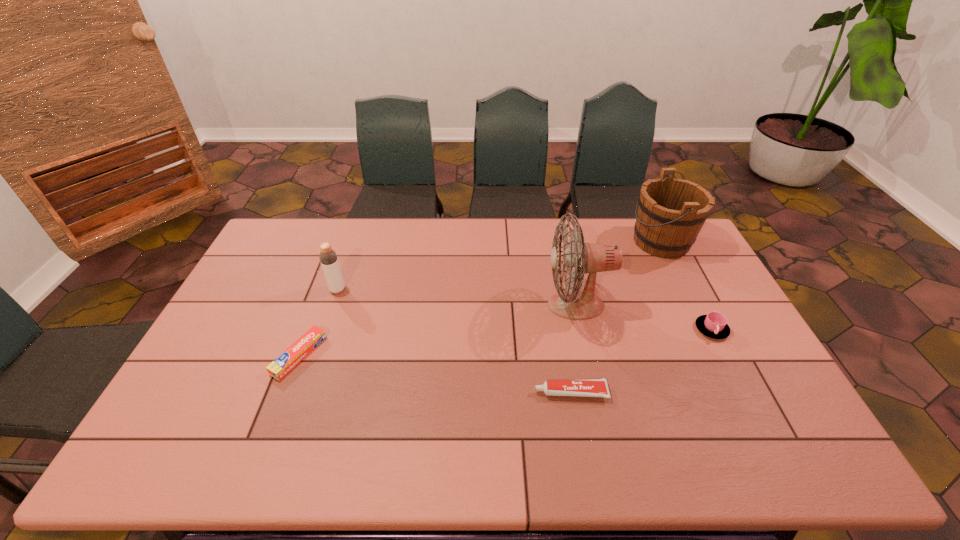
Identify the location of free space located 0.100m on the right of the farther toothpaste. (356, 355).

Locate an element on the screen. object that is at the far edge is located at coordinates (671, 212).

This screenshot has width=960, height=540. I want to click on wine bucket located at the right edge, so click(671, 212).

Where is `cup at the right edge`? This screenshot has width=960, height=540. cup at the right edge is located at coordinates (714, 325).

You are a GUI agent. You are given a task and a screenshot of the screen. Output one action in this format:
    pyautogui.click(x=<x>, y=<y>)
    Task: Click on the object that is at the far right corner
    Image resolution: width=960 pixels, height=540 pixels.
    Given the screenshot: What is the action you would take?
    pyautogui.click(x=671, y=212)

Identify the location of vacant region at the far edge. This screenshot has width=960, height=540. (397, 246).

At what (x,y) coordinates should I click in order to perform the action: click on free location at the left edge of the desktop. Please return your answer as a coordinate pair (x, y). Looking at the image, I should click on (201, 353).

Identify the location of vacant space at the right edge. This screenshot has width=960, height=540. (752, 354).

The image size is (960, 540). Identify the location of free point between the shortest object and the taller toothpaste. (435, 374).

The width and height of the screenshot is (960, 540). What are the coordinates of `free space between the third tallest object and the tallest object` in the screenshot? It's located at (457, 298).